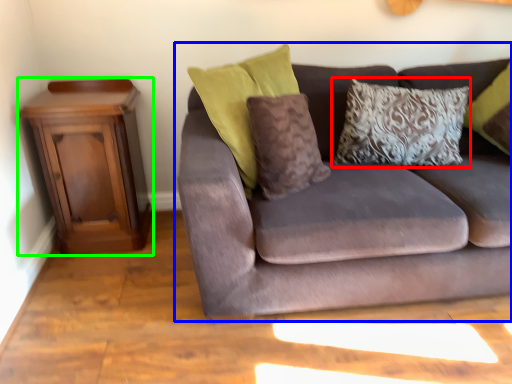
Question: Based on their relative distances, which object is farther from pillow (highlighted by a red box)? Choose from studio couch (highlighted by a blue box) and nightstand (highlighted by a green box).

Choices:
 (A) studio couch
 (B) nightstand

Answer: (B)